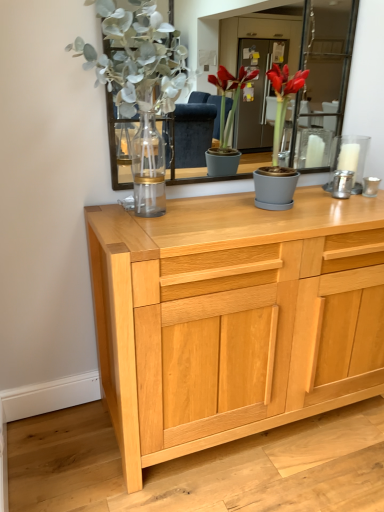
Question: From a real-world perspective, relative to matte glass vase at upper left, is matte gray pot at center vertically above or below?

Choices:
 (A) below
 (B) above

Answer: (A)

Question: Does point (273, 68) appear closer or farther from the camera than point (102, 6)?

Choices:
 (A) farther
 (B) closer

Answer: (A)

Question: Which is nearer to the matte glass vase at upper left?

Choices:
 (A) silver metallic candle holder at right
 (B) light wood cabinet at center
 (C) matte gray pot at center

Answer: (C)

Question: Which of these objects is positioned closest to the light wood cabinet at center?

Choices:
 (A) silver metallic candle holder at right
 (B) matte glass vase at upper left
 (C) matte gray pot at center

Answer: (C)